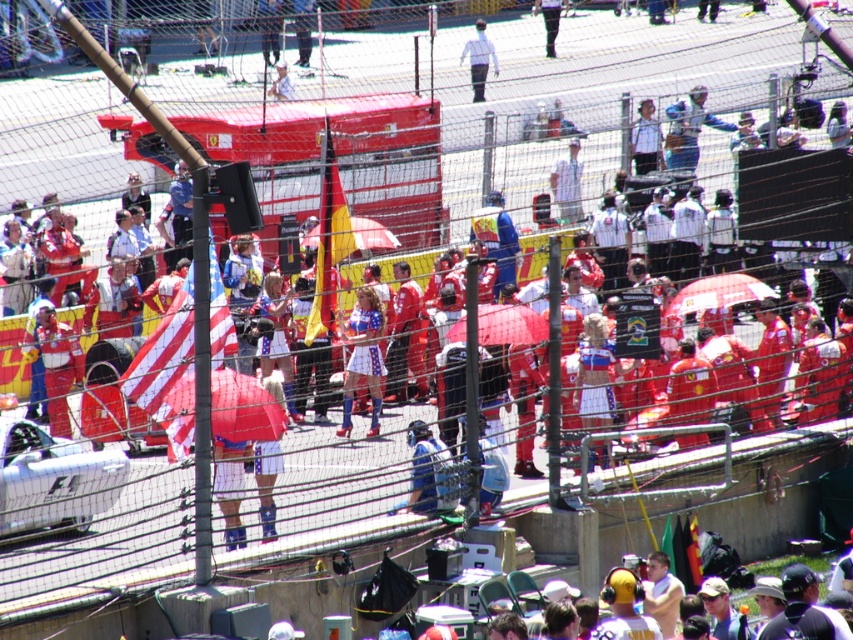
Question: Estimate the real-world distances between objects in this image. Which object is farther from the red matte bus at center?

Choices:
 (A) white fabric umbrella at center
 (B) red fabric umbrella at center
 (C) matte red dress at center

Answer: (B)

Question: Does red fabric umbrella at center appear on the right side of white fabric umbrella at center?

Choices:
 (A) yes
 (B) no

Answer: (B)

Question: Which object is closer to the camera taking this photo?

Choices:
 (A) white fabric umbrella at center
 (B) red fabric umbrella at center
 (C) matte red dress at center

Answer: (C)

Question: Which of the following is the closest to the observer?

Choices:
 (A) white fabric umbrella at center
 (B) white matte shirt at center

Answer: (A)

Question: Is red matte bus at center above white matte shirt at center?

Choices:
 (A) no
 (B) yes

Answer: (A)

Question: Is red matte bus at center to the left of white fabric umbrella at center from the viewer's perspective?

Choices:
 (A) yes
 (B) no

Answer: (A)